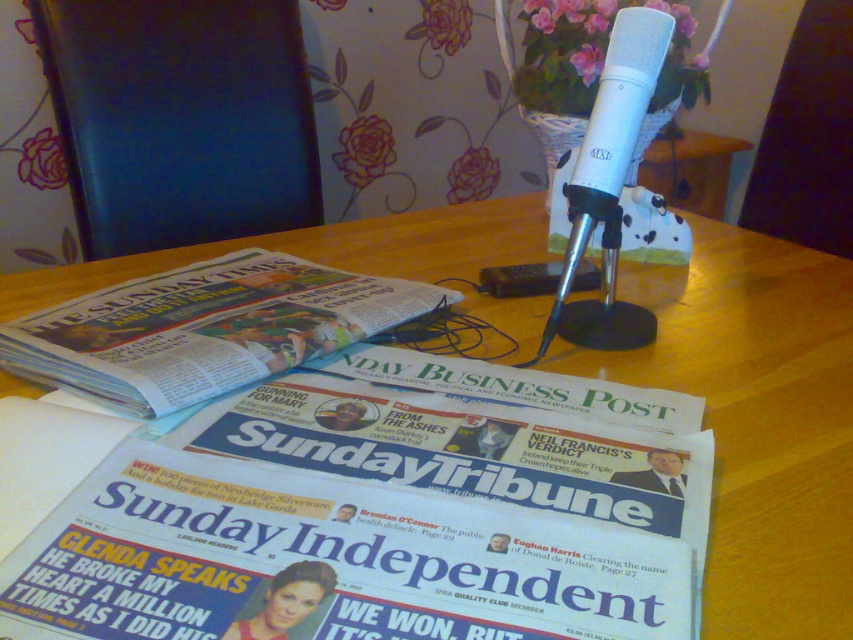
Between white glossy newspaper at center and white matte microphone at center, which one has less height?

With less height is white glossy newspaper at center.

Is white glossy newspaper at center to the left of white matte microphone at center from the viewer's perspective?

Indeed, white glossy newspaper at center is positioned on the left side of white matte microphone at center.

The width and height of the screenshot is (853, 640). Describe the element at coordinates (206, 328) in the screenshot. I see `white glossy newspaper at center` at that location.

Image resolution: width=853 pixels, height=640 pixels. What are the coordinates of `white glossy newspaper at center` in the screenshot? It's located at (206, 328).

Is point (637, 272) positioned before point (413, 289)?

No.

Is wooden table at center closer to the viewer compared to white glossy newspaper at center?

Yes, wooden table at center is closer to the viewer.

Who is more forward, (828, 532) or (151, 376)?

Point (828, 532)

Identify the location of wooden table at center. tap(757, 420).

Which of these two, wooden table at center or white matte microphone at center, stands shorter?

With less height is white matte microphone at center.

Is wooden table at center thinner than white matte microphone at center?

No, wooden table at center is not thinner than white matte microphone at center.

Locate an element on the screen. This screenshot has height=640, width=853. wooden table at center is located at coordinates (757, 420).